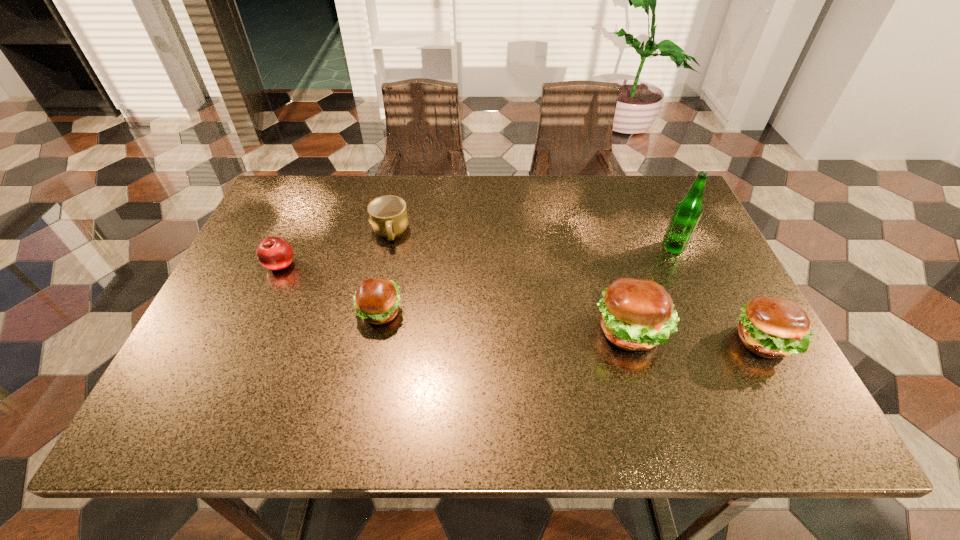
To make them evenly spaced by inserting another hamburger among them, please locate a vacant spot for this new hamburger. Please provide its 2D coordinates. Your answer should be formatted as a tuple, i.e. [(x, y)], where the tuple contains the x and y coordinates of a point satisfying the conditions above.

[(503, 321)]